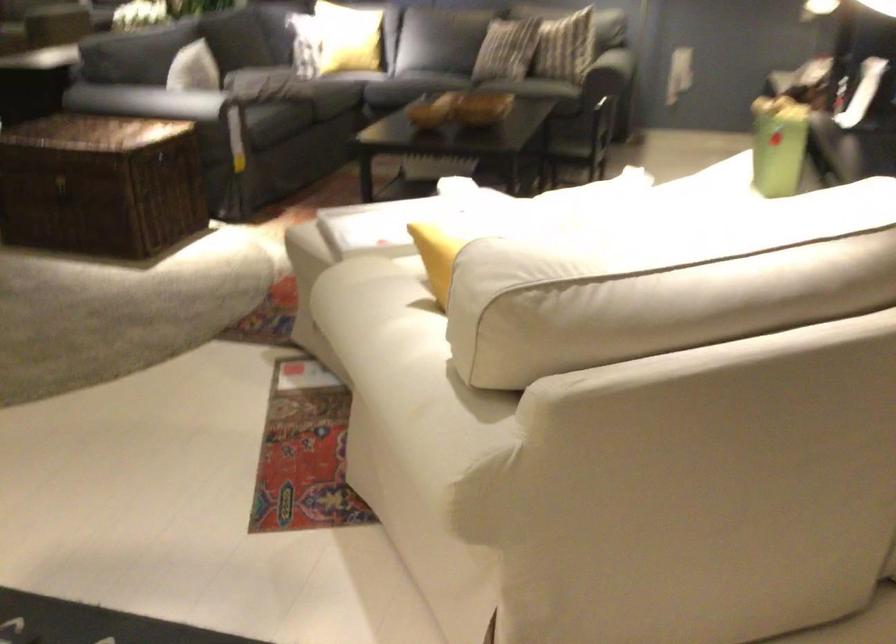
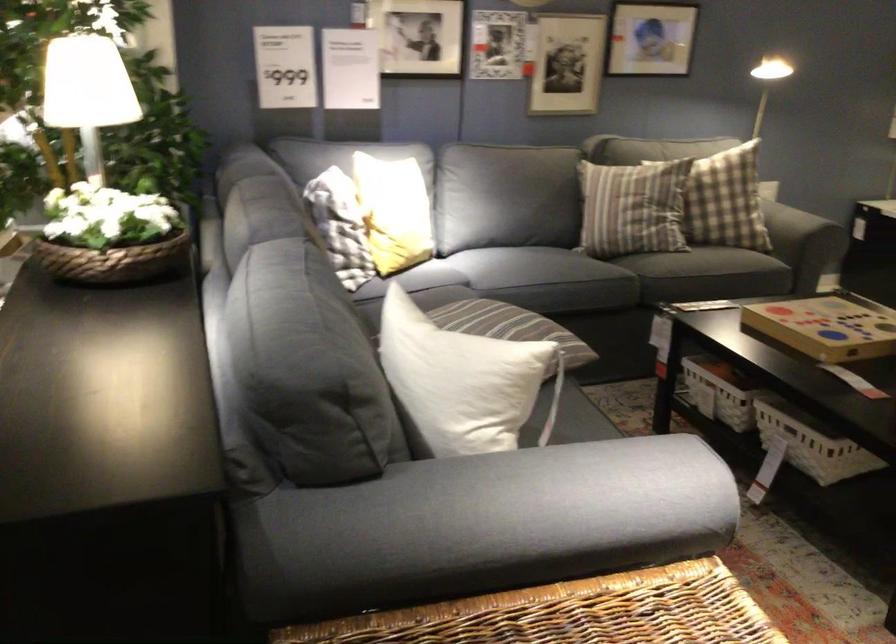
Locate, in the second image, the point that corresponds to point 160,100 in the first image.

(528, 500)